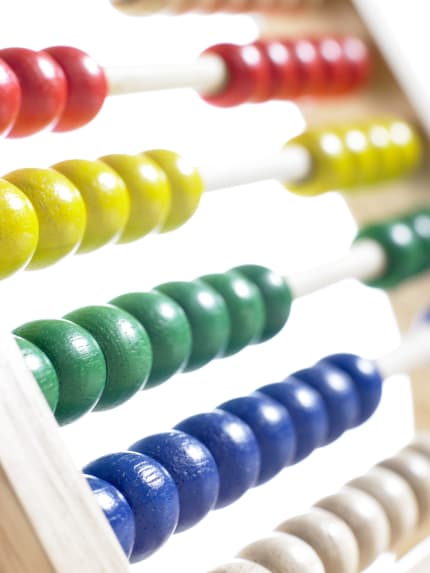
You are a GUI agent. You are given a task and a screenshot of the screen. Output one action in this format:
    pyautogui.click(x=<x>, y=<y>)
    Task: Click on the red abacus beads
    The width and height of the screenshot is (430, 573).
    Given the screenshot: What is the action you would take?
    pyautogui.click(x=10, y=87), pyautogui.click(x=41, y=82), pyautogui.click(x=79, y=78), pyautogui.click(x=243, y=80), pyautogui.click(x=273, y=76), pyautogui.click(x=282, y=72), pyautogui.click(x=316, y=70), pyautogui.click(x=337, y=68), pyautogui.click(x=353, y=64)